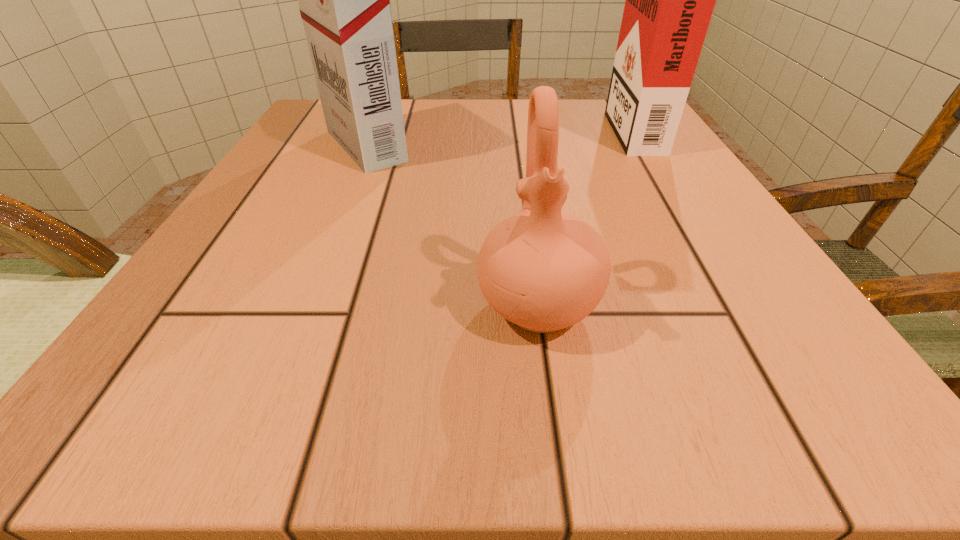
At what (x,y) coordinates should I click in order to perform the action: click on object that is at the near edge. Please return your answer as a coordinate pair (x, y). Looking at the image, I should click on (543, 270).

Find the location of `object located at the left edge`. object located at the left edge is located at coordinates (344, 0).

Where is `object located in the right edge section of the desktop`? object located in the right edge section of the desktop is located at coordinates (669, 2).

Find the location of `object that is at the far left corner`. object that is at the far left corner is located at coordinates (344, 0).

What are the coordinates of `object located at the far right corner` in the screenshot? It's located at (669, 2).

You are a GUI agent. You are given a task and a screenshot of the screen. Output one action in this format:
    pyautogui.click(x=<x>, y=<y>)
    Task: Click on the vacant area at the far edge
    This screenshot has height=540, width=960.
    Given the screenshot: What is the action you would take?
    pyautogui.click(x=504, y=111)

In the image, there is a desktop. Identify the location of vacant space at the near edge. (364, 357).

In the image, there is a desktop. At what (x,y) coordinates should I click in order to perform the action: click on vacant space at the left edge. Please return your answer as a coordinate pair (x, y). Looking at the image, I should click on (258, 180).

Locate an element on the screen. The width and height of the screenshot is (960, 540). free space at the right edge of the desktop is located at coordinates (639, 214).

Identify the location of blank area at the near left corner. The width and height of the screenshot is (960, 540). (213, 360).